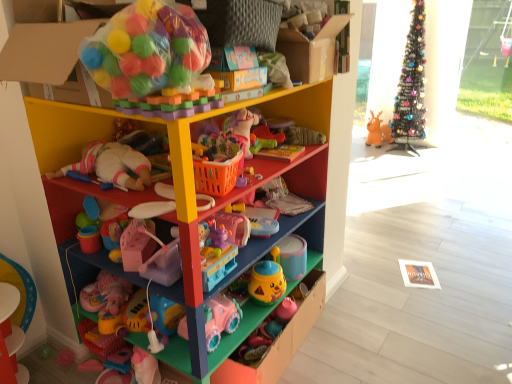
Question: Are transparent glass door at upper right and translucent plastic ball pit at upper left, which is counted as the first toy, starting from the front, beside each other?

Choices:
 (A) yes
 (B) no

Answer: (B)

Question: Is transparent glass door at upper right smaller than translucent plastic ball pit at upper left, which is counted as the sixth toy, starting from the right?

Choices:
 (A) yes
 (B) no

Answer: (B)

Question: Is transparent glass door at upper right taller than translucent plastic ball pit at upper left, which is counted as the sixth toy, starting from the right?

Choices:
 (A) yes
 (B) no

Answer: (A)

Question: Is transparent glass door at upper right thinner than translucent plastic ball pit at upper left, acting as the second toy starting from the top?

Choices:
 (A) no
 (B) yes

Answer: (B)

Question: From a real-world perspective, is transparent glass door at upper right positioned over translucent plastic ball pit at upper left, which is counted as the first toy, starting from the front, based on gravity?

Choices:
 (A) yes
 (B) no

Answer: (B)

Question: Is transparent glass door at upper right far away from translucent plastic ball pit at upper left, the fifth toy positioned from the bottom?

Choices:
 (A) no
 (B) yes

Answer: (B)

Question: Can you confirm if translucent plastic ball pit at upper left, which is the first toy from left to right, is shorter than pink plastic toy at center, acting as the 3th toy starting from the left?

Choices:
 (A) no
 (B) yes

Answer: (A)

Question: Would you say translucent plastic ball pit at upper left, which is counted as the first toy, starting from the front, contains pink plastic toy at center, the 4th toy viewed from the back?

Choices:
 (A) yes
 (B) no

Answer: (B)

Question: Is translucent plastic ball pit at upper left, which is the first toy from left to right, wider than pink plastic toy at center, the fourth toy from the top?

Choices:
 (A) yes
 (B) no

Answer: (B)

Question: Does translucent plastic ball pit at upper left, acting as the second toy starting from the top, appear on the right side of pink plastic toy at center, the fourth toy from the top?

Choices:
 (A) yes
 (B) no

Answer: (B)

Question: Can you confirm if translucent plastic ball pit at upper left, the fifth toy positioned from the bottom, is taller than pink plastic toy at center, acting as the 3th toy starting from the left?

Choices:
 (A) yes
 (B) no

Answer: (A)

Question: Are translucent plastic ball pit at upper left, placed as the sixth toy when sorted from back to front, and pink plastic toy at center, the 4th toy viewed from the back, beside each other?

Choices:
 (A) yes
 (B) no

Answer: (B)

Question: Is translucent plastic ball pit at upper left, the fifth toy positioned from the bottom, facing towards pink plastic toy car at lower center, acting as the sixth toy starting from the top?

Choices:
 (A) yes
 (B) no

Answer: (B)